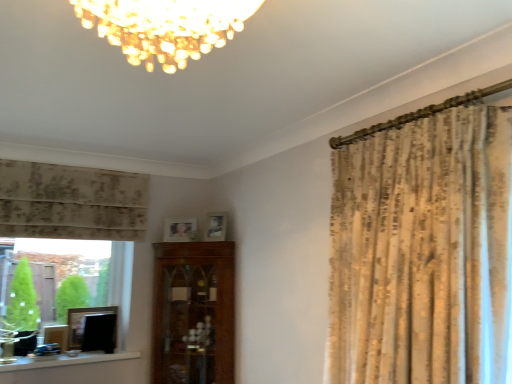
Question: In terms of size, does white painted wood at lower left appear bigger or smaller than green glass at left?

Choices:
 (A) small
 (B) big

Answer: (A)

Question: Is white painted wood at lower left taller or shorter than green glass at left?

Choices:
 (A) tall
 (B) short

Answer: (B)

Question: Which object is the closest to the neutral floral fabric curtain at left?

Choices:
 (A) white painted wood at lower left
 (B) matte black picture frame at lower left, the 3th picture frame viewed from the right
 (C) green glass at left
 (D) matte wooden picture frame at center, the second picture frame from the top
 (E) matte wooden picture frame at upper center, which is the 1th picture frame in right-to-left order

Answer: (C)

Question: Based on their relative distances, which object is farther from the matte black picture frame at lower left, the 3th picture frame viewed from the right?

Choices:
 (A) green glass at left
 (B) matte wooden picture frame at center, the second picture frame from the top
 (C) matte wooden picture frame at upper center, which is the fourth picture frame in left-to-right order
 (D) white painted wood at lower left
 (E) neutral floral fabric curtain at left

Answer: (C)